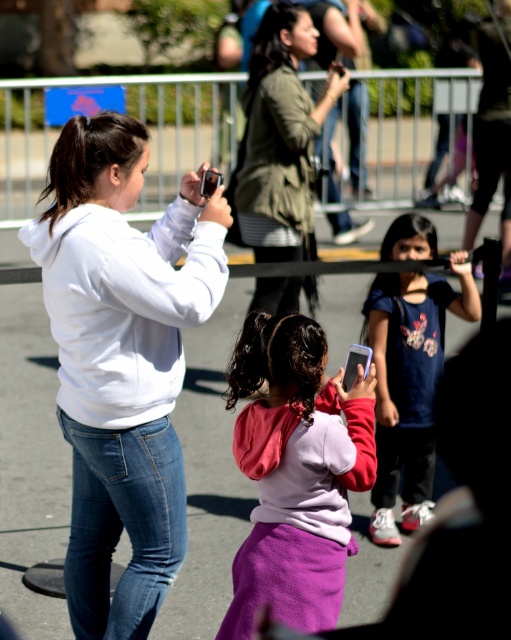
Does white matte hoodie at upper left have a greater width compared to green matte jacket at center?

Yes, white matte hoodie at upper left is wider than green matte jacket at center.

This screenshot has width=511, height=640. I want to click on white matte hoodie at upper left, so click(122, 358).

You are a GUI agent. You are given a task and a screenshot of the screen. Output one action in this format:
    pyautogui.click(x=<x>, y=<y>)
    Task: Click on the white matte hoodie at upper left
    The height and width of the screenshot is (640, 511).
    Given the screenshot: What is the action you would take?
    pyautogui.click(x=122, y=358)

At what (x,y) coordinates should I click in order to perform the action: click on white matte hoodie at upper left. Please return your answer as a coordinate pair (x, y). The height and width of the screenshot is (640, 511). Looking at the image, I should click on (122, 358).

Between dark blue fabric shirt at center and green matte jacket at center, which one appears on the left side from the viewer's perspective?

green matte jacket at center is more to the left.

Does dark blue fabric shirt at center come in front of green matte jacket at center?

Yes, dark blue fabric shirt at center is in front of green matte jacket at center.

Where is `dark blue fabric shirt at center`? This screenshot has height=640, width=511. dark blue fabric shirt at center is located at coordinates (409, 385).

Does blue denim jeans at center appear on the right side of green matte jacket at center?

No, blue denim jeans at center is not to the right of green matte jacket at center.

Does blue denim jeans at center appear over green matte jacket at center?

Incorrect, blue denim jeans at center is not positioned above green matte jacket at center.

Between point (123, 488) and point (295, 33), which one is positioned in front?

Positioned in front is point (123, 488).

The width and height of the screenshot is (511, 640). What are the coordinates of `blue denim jeans at center` in the screenshot? It's located at (123, 524).